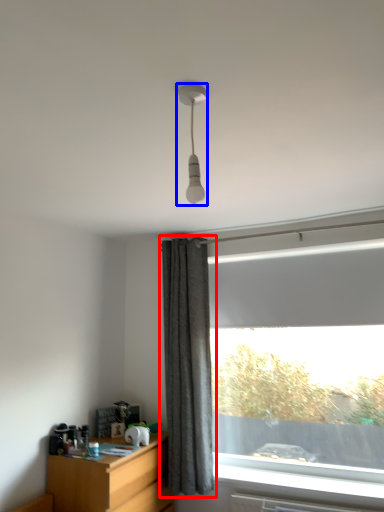
Question: Which object appears farthest to the camera in this image, curtain (highlighted by a red box) or lamp (highlighted by a blue box)?

Choices:
 (A) curtain
 (B) lamp

Answer: (A)